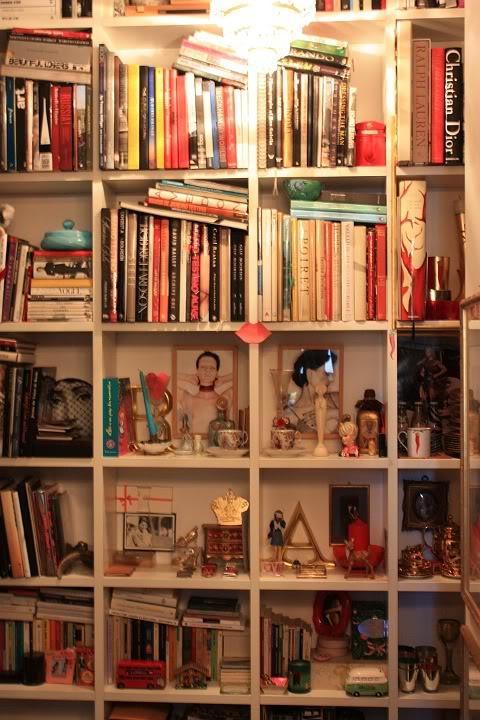
Where is `shelf`? The height and width of the screenshot is (720, 480). shelf is located at coordinates (164, 18), (177, 174), (185, 327), (181, 464), (180, 582), (192, 692).